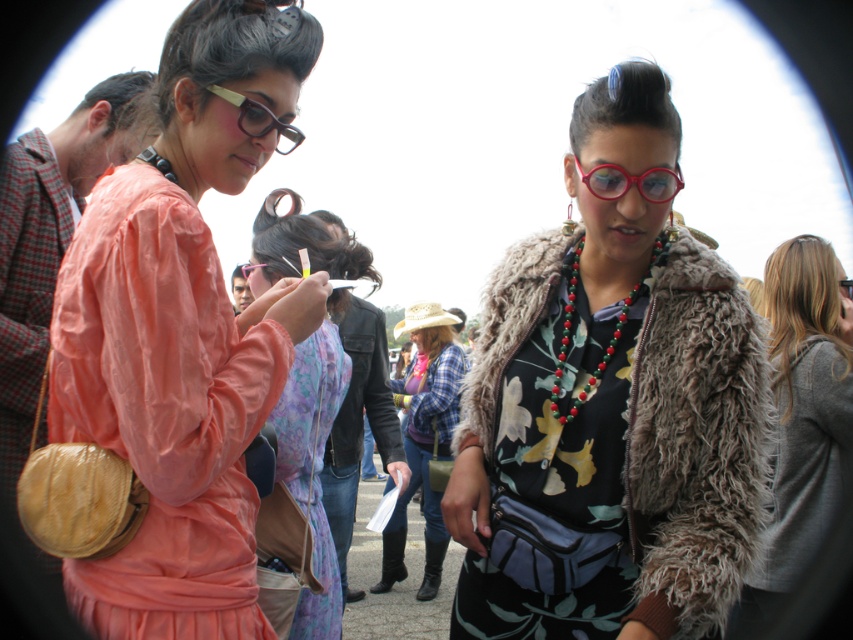
Between matte pink dress at center and shiny red plastic glasses at center, which one appears on the right side from the viewer's perspective?

shiny red plastic glasses at center is more to the right.

Does point (315, 497) come behind point (651, 168)?

Yes, point (315, 497) is behind point (651, 168).

Is point (340, 385) farther from camera compared to point (607, 172)?

Yes, point (340, 385) is behind point (607, 172).

Where is `matte pink dress at center`? matte pink dress at center is located at coordinates (312, 465).

Which is above, matte peach dress at center or gray wool sweater at right?

matte peach dress at center is above.

Who is positioned more to the right, matte peach dress at center or gray wool sweater at right?

gray wool sweater at right

Who is more forward, (x=252, y=64) or (x=811, y=307)?

Point (x=252, y=64) is in front.

Find the location of a particular element. The height and width of the screenshot is (640, 853). matte peach dress at center is located at coordinates (183, 333).

What do you see at coordinates (183, 333) in the screenshot?
I see `matte peach dress at center` at bounding box center [183, 333].

Is point (250, 561) less distant than point (254, 262)?

That is True.

What do you see at coordinates (183, 333) in the screenshot? I see `matte peach dress at center` at bounding box center [183, 333].

Locate an element on the screen. This screenshot has width=853, height=640. matte peach dress at center is located at coordinates (183, 333).